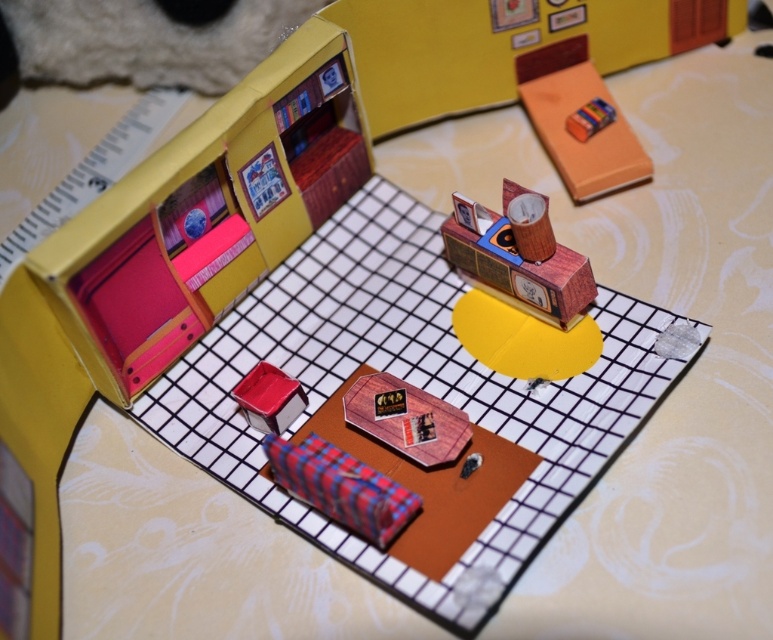
Question: Which of the following is the closest to the observer?

Choices:
 (A) (421, 417)
 (B) (591, 102)
 (C) (4, 352)
 (D) (581, 268)

Answer: (C)

Question: Does wooden clock at upper center have a larger size compared to plaid fabric eraser at center?

Choices:
 (A) yes
 (B) no

Answer: (A)

Question: Which object is positioned farthest from the plaid fabric couch at lower left?

Choices:
 (A) wooden book at center
 (B) orange matte book at upper right
 (C) wooden clock at upper center
 (D) matte red cube at center

Answer: (B)

Question: Which point appears farthest from the camera in this image?

Choices:
 (A) (417, 504)
 (B) (571, 56)
 (C) (518, 296)
 (D) (213, 234)

Answer: (B)

Question: Does orange matte book at upper right have a larger size compared to plaid fabric eraser at center?

Choices:
 (A) yes
 (B) no

Answer: (A)

Question: Can you confirm if plaid fabric couch at lower left is wider than plaid fabric eraser at center?

Choices:
 (A) no
 (B) yes

Answer: (B)